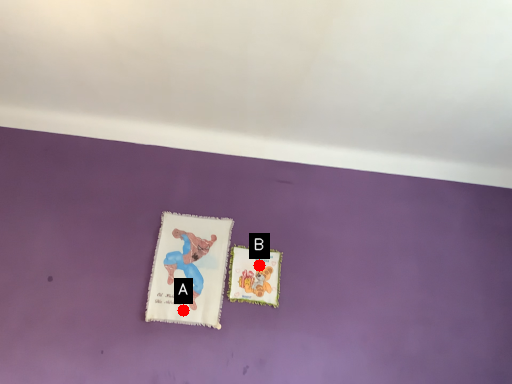
Question: Two points are circled on the image, labeled by A and B beside each circle. Which of the following is the closest to the observer?

Choices:
 (A) A is closer
 (B) B is closer

Answer: (A)